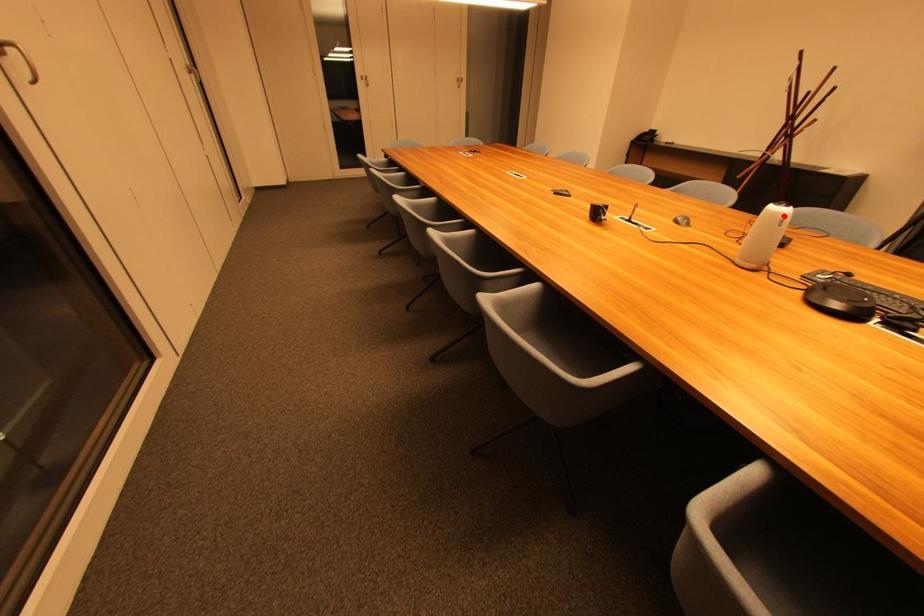
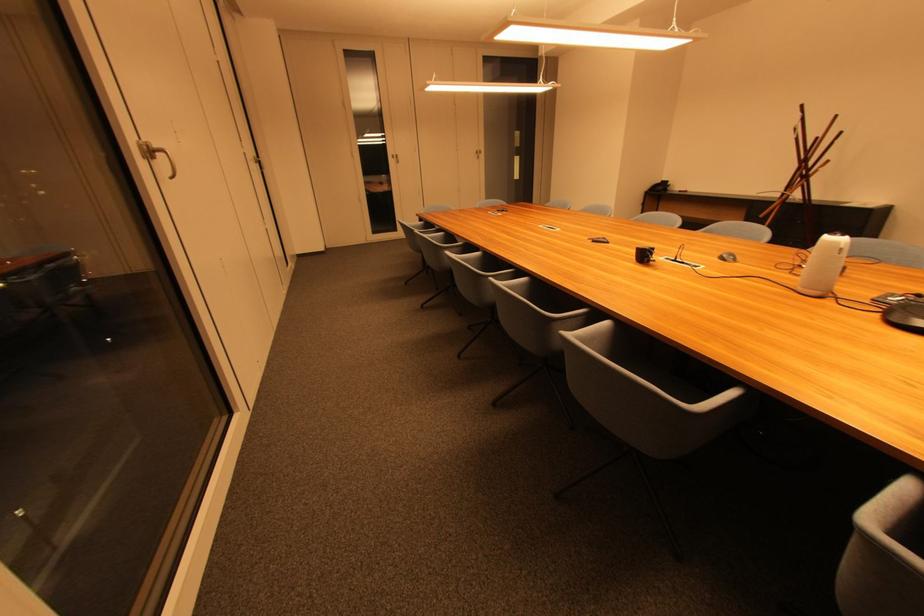
Question: I am providing you with two images of the same scene from different viewpoints. In image1, a red point is highlighted. Considering the same 3D point in image2, which of the following is correct?

Choices:
 (A) It is closer
 (B) It is farther

Answer: (A)